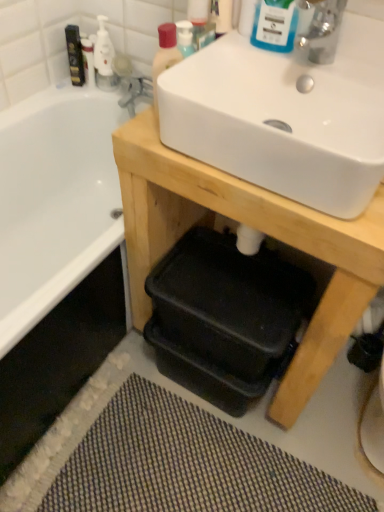
Question: Is matte black mouthwash at upper left, the second mouthwash in the front-to-back sequence, positioned far away from textured gray bath mat at lower center?

Choices:
 (A) yes
 (B) no

Answer: (A)

Question: Is matte black mouthwash at upper left, the first mouthwash when ordered from back to front, outside of textured gray bath mat at lower center?

Choices:
 (A) yes
 (B) no

Answer: (A)

Question: Are matte black mouthwash at upper left, the second mouthwash in the front-to-back sequence, and textured gray bath mat at lower center making contact?

Choices:
 (A) no
 (B) yes

Answer: (A)

Question: From a real-world perspective, is matte black mouthwash at upper left, the first mouthwash when ordered from back to front, beneath textured gray bath mat at lower center?

Choices:
 (A) no
 (B) yes

Answer: (A)

Question: Does matte black mouthwash at upper left, acting as the first mouthwash starting from the top, have a lesser height compared to textured gray bath mat at lower center?

Choices:
 (A) yes
 (B) no

Answer: (B)

Question: Is white glossy sink at upper center to the left or to the right of white glossy bottle at upper left in the image?

Choices:
 (A) left
 (B) right

Answer: (B)

Question: From a real-world perspective, is white glossy sink at upper center above or below white glossy bottle at upper left?

Choices:
 (A) below
 (B) above

Answer: (B)

Question: Is point (286, 137) closer or farther from the camera than point (112, 87)?

Choices:
 (A) closer
 (B) farther

Answer: (A)

Question: Considering the positions of white glossy sink at upper center and white glossy bottle at upper left in the image, is white glossy sink at upper center bigger or smaller than white glossy bottle at upper left?

Choices:
 (A) big
 (B) small

Answer: (A)

Question: Is blue glossy bottle at upper center, positioned as the 1th mouthwash in right-to-left order, situated inside matte plastic bottle at upper center or outside?

Choices:
 (A) outside
 (B) inside

Answer: (A)

Question: In terms of width, does blue glossy bottle at upper center, acting as the 1th mouthwash starting from the front, look wider or thinner when compared to matte plastic bottle at upper center?

Choices:
 (A) wide
 (B) thin

Answer: (A)

Question: Is blue glossy bottle at upper center, which is counted as the second mouthwash, starting from the back, to the left or to the right of matte plastic bottle at upper center in the image?

Choices:
 (A) right
 (B) left

Answer: (A)

Question: In the image, is blue glossy bottle at upper center, which is counted as the second mouthwash, starting from the top, positioned in front of or behind matte plastic bottle at upper center?

Choices:
 (A) front
 (B) behind

Answer: (A)

Question: Do you think matte plastic bottle at upper center is within blue glossy bottle at upper center, which is counted as the second mouthwash, starting from the top, or outside of it?

Choices:
 (A) inside
 (B) outside

Answer: (B)

Question: Is matte plastic bottle at upper center to the left or to the right of blue glossy bottle at upper center, positioned as the 1th mouthwash in right-to-left order, in the image?

Choices:
 (A) right
 (B) left

Answer: (B)